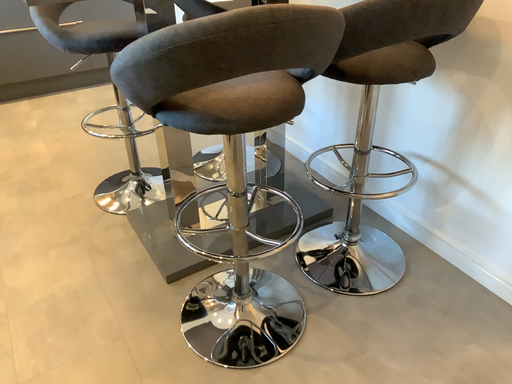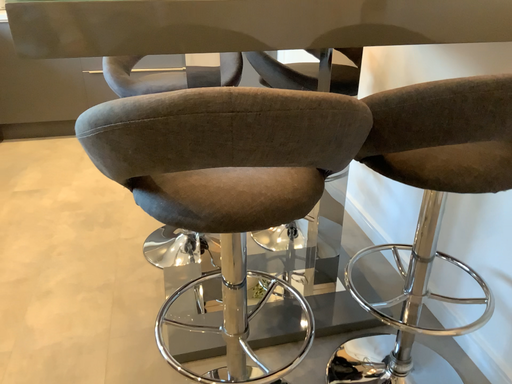
Question: How did the camera likely rotate when shooting the video?

Choices:
 (A) rotated left
 (B) rotated right

Answer: (A)